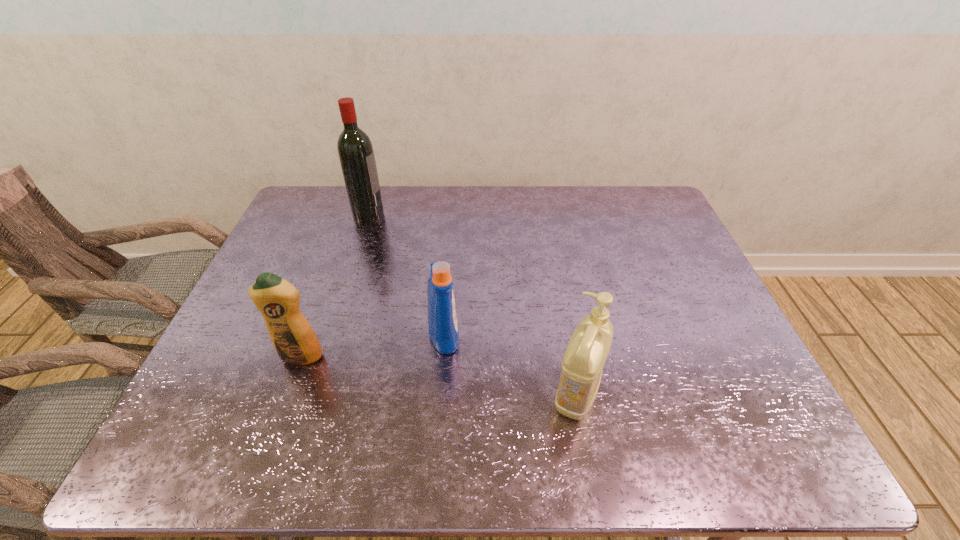
You are a GUI agent. You are given a task and a screenshot of the screen. Output one action in this format:
    pyautogui.click(x=<x>, y=<y>)
    Task: Click on the object present at the near edge
    This screenshot has height=540, width=960.
    Given the screenshot: What is the action you would take?
    pyautogui.click(x=582, y=365)

Where is `object located in the left edge section of the desktop`? object located in the left edge section of the desktop is located at coordinates (292, 336).

In the image, there is a desktop. Identify the location of vacant space at the far edge. (609, 195).

Image resolution: width=960 pixels, height=540 pixels. I want to click on vacant space at the near edge of the desktop, so click(x=312, y=440).

In the image, there is a desktop. Where is `blank space at the left edge`? This screenshot has height=540, width=960. blank space at the left edge is located at coordinates (233, 358).

At what (x,y) coordinates should I click in order to perform the action: click on vacant space at the right edge. Please return your answer as a coordinate pair (x, y). Looking at the image, I should click on tap(757, 386).

In the image, there is a desktop. Where is `vacant space at the far left corner`? The image size is (960, 540). vacant space at the far left corner is located at coordinates (334, 209).

In the image, there is a desktop. Where is `vacant space at the near right corner`? vacant space at the near right corner is located at coordinates (728, 443).

Find the location of a particular element. This screenshot has width=960, height=540. free point between the wine bottle and the rightmost detergent is located at coordinates (472, 305).

Image resolution: width=960 pixels, height=540 pixels. What are the coordinates of `free space between the rightmost detergent and the second detergent from right to left` in the screenshot? It's located at (511, 364).